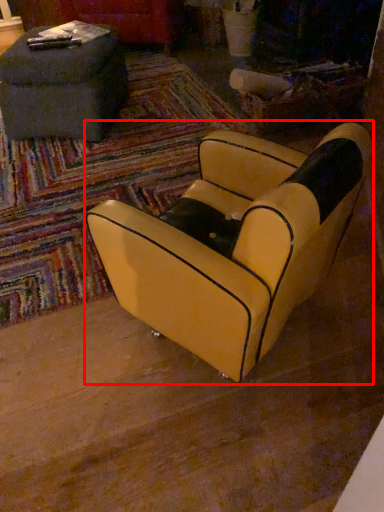
Question: From the image's perspective, what is the correct spatial positioning of chair (annotated by the red box) in reference to table?

Choices:
 (A) below
 (B) above

Answer: (A)